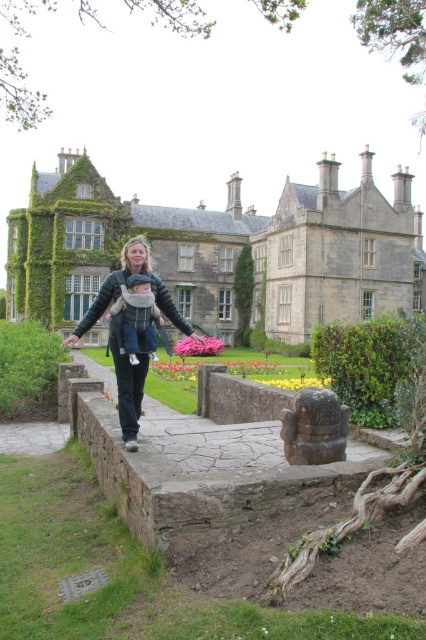
Who is more distant from viewer, (x=161, y=412) or (x=37, y=422)?

Positioned behind is point (x=161, y=412).

Can you confirm if stone at center is shorter than gray stone path at lower left?

Incorrect, stone at center's height does not fall short of gray stone path at lower left's.

Describe the element at coordinates (207, 467) in the screenshot. I see `stone at center` at that location.

Find the location of a particular element. The width and height of the screenshot is (426, 640). stone at center is located at coordinates (207, 467).

Is denim jacket at center to the right of gray stone path at lower left from the viewer's perspective?

Indeed, denim jacket at center is positioned on the right side of gray stone path at lower left.

Does denim jacket at center appear under gray stone path at lower left?

No.

At what (x,y) coordinates should I click in order to perform the action: click on denim jacket at center. Please return your answer as a coordinate pair (x, y). Looking at the image, I should click on (132, 326).

Can you confirm if stone at center is shorter than denim jacket at center?

Correct, stone at center is not as tall as denim jacket at center.

Can you confirm if stone at center is thinner than denim jacket at center?

No.

Which is in front, point (135, 493) or point (192, 336)?

Point (135, 493)

Find the location of a particular element. stone at center is located at coordinates point(207,467).